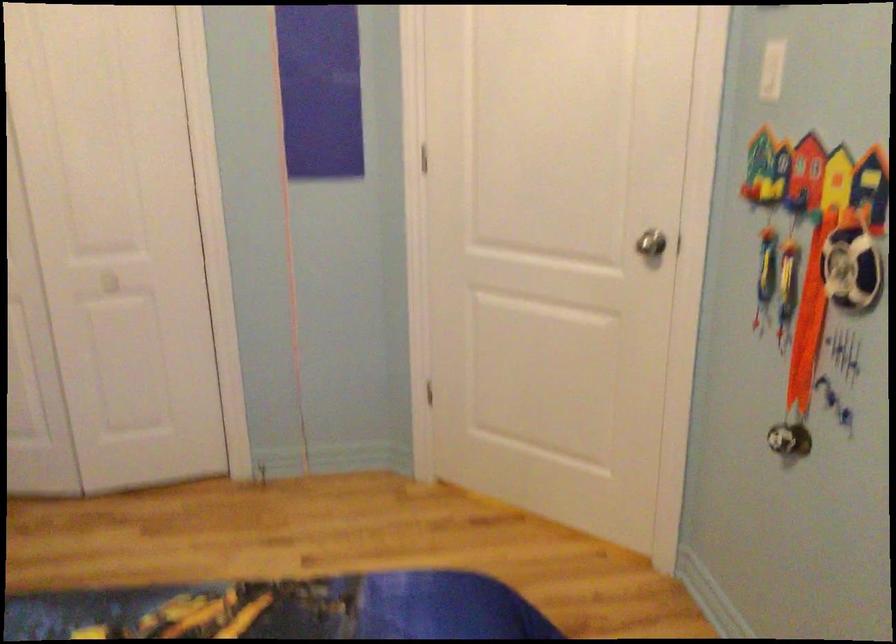
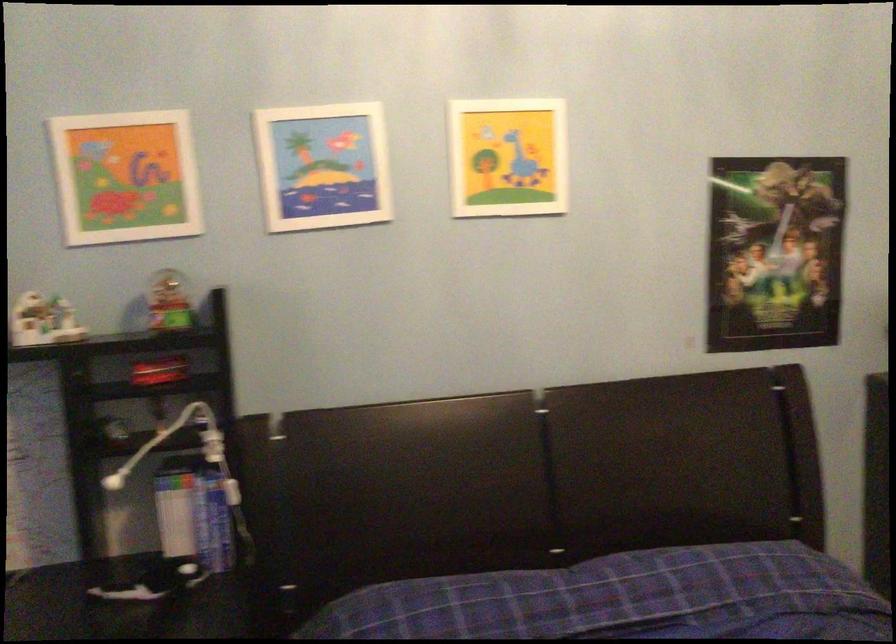
Question: How did the camera likely rotate?

Choices:
 (A) Left
 (B) Right
 (C) Up
 (D) Down

Answer: (A)